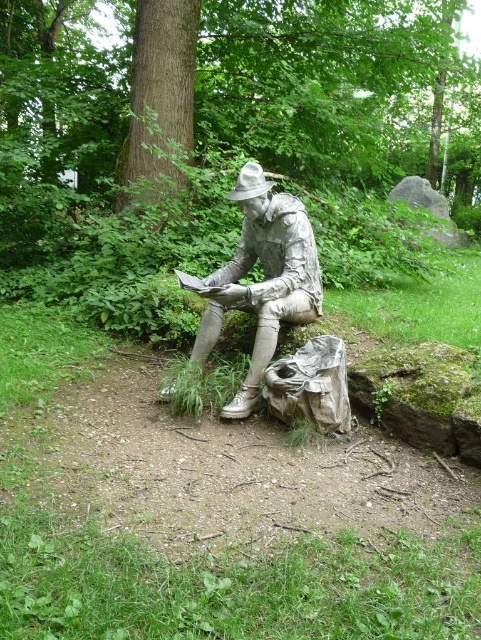
Question: Which of the following is the farthest from the observer?

Choices:
 (A) (x=288, y=316)
 (B) (x=313, y=147)
 (C) (x=142, y=106)

Answer: (B)

Question: Considering the real-world distances, which object is farthest from the green textured tree at center?

Choices:
 (A) brushed metal statue at center
 (B) smooth brown bark at center

Answer: (A)

Question: Which point is farther to the camera?

Choices:
 (A) brushed metal statue at center
 (B) smooth brown bark at center
 (C) green textured tree at center

Answer: (C)

Question: Does green textured tree at center come in front of brushed metal statue at center?

Choices:
 (A) yes
 (B) no

Answer: (B)

Question: Is brushed metal statue at center further to camera compared to smooth brown bark at center?

Choices:
 (A) yes
 (B) no

Answer: (B)

Question: Does brushed metal statue at center appear on the right side of smooth brown bark at center?

Choices:
 (A) no
 (B) yes

Answer: (B)